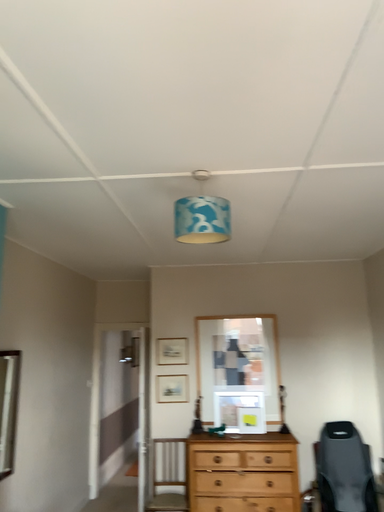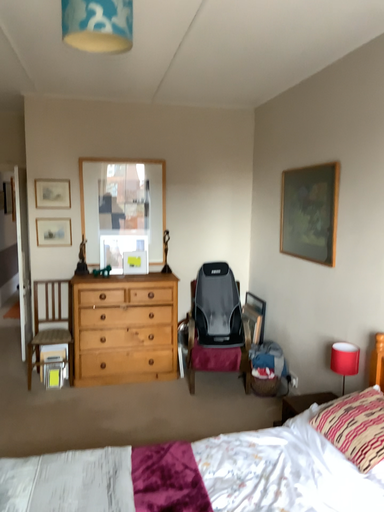
Question: How did the camera likely rotate when shooting the video?

Choices:
 (A) rotated downward
 (B) rotated upward

Answer: (A)